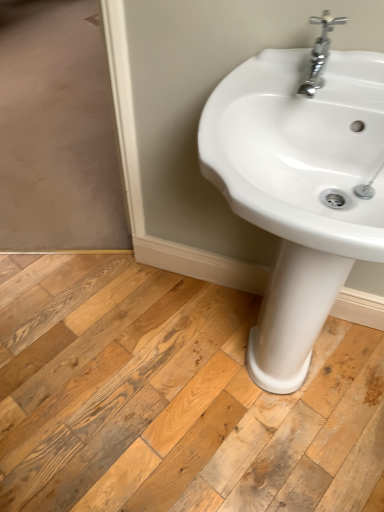
Question: Considering the relative sizes of natural wood floor at center and chrome metallic faucet at upper right in the image provided, is natural wood floor at center shorter than chrome metallic faucet at upper right?

Choices:
 (A) no
 (B) yes

Answer: (B)

Question: Considering the relative positions of natural wood floor at center and chrome metallic faucet at upper right in the image provided, is natural wood floor at center to the right of chrome metallic faucet at upper right from the viewer's perspective?

Choices:
 (A) yes
 (B) no

Answer: (B)

Question: Can chrome metallic faucet at upper right be found inside natural wood floor at center?

Choices:
 (A) no
 (B) yes

Answer: (A)

Question: Is natural wood floor at center positioned with its back to chrome metallic faucet at upper right?

Choices:
 (A) yes
 (B) no

Answer: (B)

Question: Is natural wood floor at center positioned behind chrome metallic faucet at upper right?

Choices:
 (A) yes
 (B) no

Answer: (A)

Question: From the image's perspective, relative to natural wood floor at center, is white glossy sink at center above or below?

Choices:
 (A) below
 (B) above

Answer: (B)

Question: Based on their positions, is white glossy sink at center located to the left or right of natural wood floor at center?

Choices:
 (A) left
 (B) right

Answer: (B)

Question: From a real-world perspective, is white glossy sink at center physically located above or below natural wood floor at center?

Choices:
 (A) above
 (B) below

Answer: (A)

Question: Is white glossy sink at center taller or shorter than natural wood floor at center?

Choices:
 (A) short
 (B) tall

Answer: (B)

Question: Is white glossy sink at center wider or thinner than chrome metallic faucet at upper right?

Choices:
 (A) thin
 (B) wide

Answer: (B)

Question: Is point (322, 27) positioned closer to the camera than point (306, 92)?

Choices:
 (A) farther
 (B) closer

Answer: (B)

Question: Based on their positions, is white glossy sink at center located to the left or right of chrome metallic faucet at upper right?

Choices:
 (A) right
 (B) left

Answer: (A)

Question: Considering the positions of white glossy sink at center and chrome metallic faucet at upper right in the image, is white glossy sink at center bigger or smaller than chrome metallic faucet at upper right?

Choices:
 (A) small
 (B) big

Answer: (B)

Question: Is point tap(334, 24) closer or farther from the camera than point tap(114, 501)?

Choices:
 (A) closer
 (B) farther

Answer: (A)

Question: Is chrome metallic faucet at upper right taller or shorter than natural wood floor at center?

Choices:
 (A) tall
 (B) short

Answer: (A)